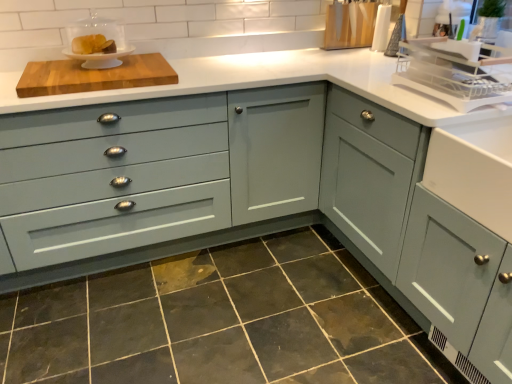
You are a GUI agent. You are given a task and a screenshot of the screen. Output one action in this format:
    pyautogui.click(x=<x>, y=<y>)
    Task: Click on the matte gray cabinet at center, which is the second cabinetry from right to left
    The width and height of the screenshot is (512, 384).
    Given the screenshot: What is the action you would take?
    pyautogui.click(x=166, y=179)

Describe the element at coordinates (219, 321) in the screenshot. I see `dark gray granite at lower center` at that location.

At what (x,y) coordinates should I click in order to perform the action: click on white glossy cake stand at upper left, positioned as the third appliance in right-to-left order. Please return your answer as a coordinate pair (x, y). This screenshot has height=384, width=512. Looking at the image, I should click on (97, 42).

Image resolution: width=512 pixels, height=384 pixels. In order to click on matte gray cabinet at right, the first cabinetry when ordered from right to left in this screenshot , I will do `click(407, 221)`.

Is point (85, 213) farther from viewer compared to point (458, 95)?

Yes, it is.

Does matte gray cabinet at center, which is the 1th cabinetry from left to right, touch white plastic dish rack at upper right, placed as the third appliance when sorted from back to front?

No, matte gray cabinet at center, which is the 1th cabinetry from left to right, is not next to white plastic dish rack at upper right, placed as the third appliance when sorted from back to front.

Is white glossy cake stand at upper left, the 2th appliance when ordered from back to front, bigger or smaller than matte gray cabinet at center, which is the second cabinetry from right to left?

white glossy cake stand at upper left, the 2th appliance when ordered from back to front, is smaller than matte gray cabinet at center, which is the second cabinetry from right to left.

Is white glossy cake stand at upper left, arranged as the second appliance when viewed from the front, not near matte gray cabinet at center, which is the 1th cabinetry from left to right?

white glossy cake stand at upper left, arranged as the second appliance when viewed from the front, is actually quite close to matte gray cabinet at center, which is the 1th cabinetry from left to right.

From a real-world perspective, which object rests below the other?

matte gray cabinet at center, which is the 1th cabinetry from left to right, is physically lower.

Can you tell me how much white glossy cake stand at upper left, the 2th appliance when ordered from back to front, and matte gray cabinet at center, which is the 1th cabinetry from left to right, differ in facing direction?

The angular difference between white glossy cake stand at upper left, the 2th appliance when ordered from back to front, and matte gray cabinet at center, which is the 1th cabinetry from left to right, is 1.14 degrees.

In terms of height, does matte gray cabinet at right, which is the 2th cabinetry in left-to-right order, look taller or shorter compared to wooden cutting board at upper left?

matte gray cabinet at right, which is the 2th cabinetry in left-to-right order, is taller than wooden cutting board at upper left.

How much distance is there between matte gray cabinet at right, which is the 2th cabinetry in left-to-right order, and wooden cutting board at upper left?

matte gray cabinet at right, which is the 2th cabinetry in left-to-right order, is 3.55 feet from wooden cutting board at upper left.

Consider the image. Considering the positions of objects matte gray cabinet at right, which is the 2th cabinetry in left-to-right order, and wooden cutting board at upper left in the image provided, who is in front, matte gray cabinet at right, which is the 2th cabinetry in left-to-right order, or wooden cutting board at upper left?

matte gray cabinet at right, which is the 2th cabinetry in left-to-right order, is closer to the camera.

Which of these two, matte gray cabinet at right, which is the 2th cabinetry in left-to-right order, or wooden cutting board at upper left, is wider?

matte gray cabinet at right, which is the 2th cabinetry in left-to-right order.

Which point is more distant from viewer, [335,40] or [131,50]?

The point [335,40] is more distant.

Identify the location of appliance that is above the white glossy cake stand at upper left, the 2th appliance when ordered from back to front (from the image's perspective). (349, 24).

Is wooden knife block at upper right, which is the third appliance in front-to-back order, positioned far away from white glossy cake stand at upper left, which appears as the 1th appliance when viewed from the left?

Yes.

Between wooden knife block at upper right, acting as the second appliance starting from the right, and white glossy cake stand at upper left, the 2th appliance when ordered from back to front, which one appears on the right side from the viewer's perspective?

wooden knife block at upper right, acting as the second appliance starting from the right, is more to the right.

Is white plastic dish rack at upper right, placed as the third appliance when sorted from back to front, to the left or to the right of wooden knife block at upper right, which ranks as the first appliance in back-to-front order, in the image?

white plastic dish rack at upper right, placed as the third appliance when sorted from back to front, is positioned on wooden knife block at upper right, which ranks as the first appliance in back-to-front order,'s right side.

Is the depth of white plastic dish rack at upper right, the first appliance from the front, greater than that of wooden knife block at upper right, the second appliance from the left?

No, the depth of white plastic dish rack at upper right, the first appliance from the front, is less than that of wooden knife block at upper right, the second appliance from the left.

Looking at this image, is wooden knife block at upper right, which ranks as the first appliance in back-to-front order, surrounded by white plastic dish rack at upper right, the third appliance viewed from the left?

That's incorrect, wooden knife block at upper right, which ranks as the first appliance in back-to-front order, is not inside white plastic dish rack at upper right, the third appliance viewed from the left.

Is white plastic dish rack at upper right, placed as the third appliance when sorted from back to front, oriented towards wooden knife block at upper right, acting as the second appliance starting from the right?

No.

Does wooden cutting board at upper left have a lesser height compared to matte gray cabinet at right, the first cabinetry when ordered from right to left?

Yes.

Which object is positioned more to the left, wooden cutting board at upper left or matte gray cabinet at right, which is the 2th cabinetry in left-to-right order?

wooden cutting board at upper left is more to the left.

Could you tell me if wooden cutting board at upper left is turned towards matte gray cabinet at right, which is the 2th cabinetry in left-to-right order?

No.

Considering the sizes of white glossy cake stand at upper left, arranged as the second appliance when viewed from the front, and wooden knife block at upper right, which ranks as the first appliance in back-to-front order, in the image, is white glossy cake stand at upper left, arranged as the second appliance when viewed from the front, wider or thinner than wooden knife block at upper right, which ranks as the first appliance in back-to-front order,?

white glossy cake stand at upper left, arranged as the second appliance when viewed from the front, is wider than wooden knife block at upper right, which ranks as the first appliance in back-to-front order.

Is the position of white glossy cake stand at upper left, the 2th appliance when ordered from back to front, more distant than that of wooden knife block at upper right, the second appliance from the left?

No, it is in front of wooden knife block at upper right, the second appliance from the left.

At what (x,y) coordinates should I click in order to perform the action: click on appliance that appears above the white glossy cake stand at upper left, arranged as the second appliance when viewed from the front (from a real-world perspective). Please return your answer as a coordinate pair (x, y). The image size is (512, 384). Looking at the image, I should click on (349, 24).

From the image's perspective, does white glossy cake stand at upper left, the 2th appliance when ordered from back to front, appear lower than wooden knife block at upper right, acting as the second appliance starting from the right?

Indeed, from the image's perspective, white glossy cake stand at upper left, the 2th appliance when ordered from back to front, is shown beneath wooden knife block at upper right, acting as the second appliance starting from the right.

Where is `the 1st appliance above when counting from the matte gray cabinet at center, which is the 1th cabinetry from left to right (from the image's perspective)`? the 1st appliance above when counting from the matte gray cabinet at center, which is the 1th cabinetry from left to right (from the image's perspective) is located at coordinates (455, 74).

Find the location of a particular element. the 1st cabinetry in front of the white glossy cake stand at upper left, the 2th appliance when ordered from back to front is located at coordinates (166, 179).

When comparing their distances from matte gray cabinet at right, which is the 2th cabinetry in left-to-right order, does white plastic dish rack at upper right, the first appliance from the front, or white glossy cake stand at upper left, the 2th appliance when ordered from back to front, seem further?

white glossy cake stand at upper left, the 2th appliance when ordered from back to front, lies further to matte gray cabinet at right, which is the 2th cabinetry in left-to-right order, than the other object.

When comparing their distances from dark gray granite at lower center, does white glossy cake stand at upper left, which appears as the 1th appliance when viewed from the left, or white plastic dish rack at upper right, the first appliance from the right, seem further?

white glossy cake stand at upper left, which appears as the 1th appliance when viewed from the left, lies further to dark gray granite at lower center than the other object.

Based on their spatial positions, is matte gray cabinet at center, which is the second cabinetry from right to left, or white glossy cake stand at upper left, arranged as the second appliance when viewed from the front, further from white plastic dish rack at upper right, the first appliance from the front?

The object further to white plastic dish rack at upper right, the first appliance from the front, is white glossy cake stand at upper left, arranged as the second appliance when viewed from the front.

Estimate the real-world distances between objects in this image. Which object is further from wooden knife block at upper right, which ranks as the first appliance in back-to-front order, white plastic dish rack at upper right, placed as the third appliance when sorted from back to front, or dark gray granite at lower center?

Among the two, dark gray granite at lower center is located further to wooden knife block at upper right, which ranks as the first appliance in back-to-front order.

From the image, which object appears to be farther from wooden knife block at upper right, which is the third appliance in front-to-back order, white plastic dish rack at upper right, the third appliance viewed from the left, or white glossy cake stand at upper left, positioned as the third appliance in right-to-left order?

white glossy cake stand at upper left, positioned as the third appliance in right-to-left order, is positioned further to the anchor wooden knife block at upper right, which is the third appliance in front-to-back order.

Estimate the real-world distances between objects in this image. Which object is closer to dark gray granite at lower center, white plastic dish rack at upper right, placed as the third appliance when sorted from back to front, or matte gray cabinet at right, the first cabinetry when ordered from right to left?

The object closer to dark gray granite at lower center is matte gray cabinet at right, the first cabinetry when ordered from right to left.

Based on their spatial positions, is wooden knife block at upper right, the second appliance from the left, or white glossy cake stand at upper left, the 2th appliance when ordered from back to front, closer to wooden cutting board at upper left?

white glossy cake stand at upper left, the 2th appliance when ordered from back to front, is positioned closer to the anchor wooden cutting board at upper left.

Estimate the real-world distances between objects in this image. Which object is further from wooden knife block at upper right, acting as the second appliance starting from the right, matte gray cabinet at center, which is the 1th cabinetry from left to right, or dark gray granite at lower center?

The object further to wooden knife block at upper right, acting as the second appliance starting from the right, is dark gray granite at lower center.

Locate an element on the screen. The width and height of the screenshot is (512, 384). cutting board located between white glossy cake stand at upper left, positioned as the third appliance in right-to-left order, and wooden knife block at upper right, which ranks as the first appliance in back-to-front order, in the left-right direction is located at coordinates (94, 76).

What are the coordinates of `cutting board that lies between white glossy cake stand at upper left, the 2th appliance when ordered from back to front, and dark gray granite at lower center from top to bottom` in the screenshot? It's located at (94, 76).

The width and height of the screenshot is (512, 384). What are the coordinates of `cabinetry situated between wooden cutting board at upper left and wooden knife block at upper right, which ranks as the first appliance in back-to-front order, from left to right` in the screenshot? It's located at (166, 179).

Find the location of a particular element. The width and height of the screenshot is (512, 384). appliance between white glossy cake stand at upper left, the 2th appliance when ordered from back to front, and matte gray cabinet at right, which is the 2th cabinetry in left-to-right order is located at coordinates (349, 24).